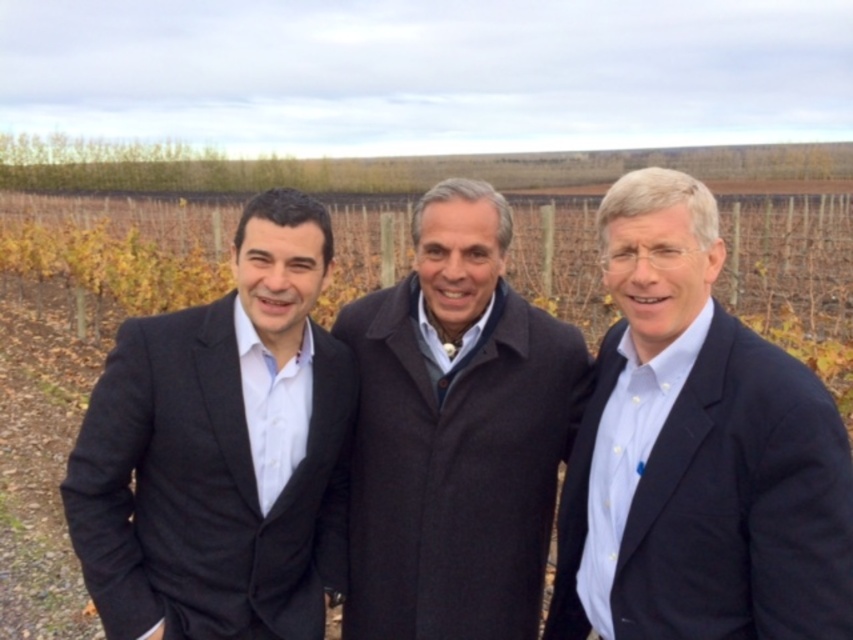
Question: Which is nearer to the matte black suit at left?

Choices:
 (A) dark brown wool coat at center
 (B) light blue shirt at center

Answer: (A)

Question: Is light blue shirt at center above dark brown wool coat at center?

Choices:
 (A) yes
 (B) no

Answer: (B)

Question: From the image, what is the correct spatial relationship of matte black suit at left in relation to dark brown wool coat at center?

Choices:
 (A) above
 (B) below

Answer: (B)

Question: Considering the relative positions of matte black suit at left and dark brown wool coat at center in the image provided, where is matte black suit at left located with respect to dark brown wool coat at center?

Choices:
 (A) above
 (B) below

Answer: (B)

Question: Which point appears closest to the camera in this image?

Choices:
 (A) (x=621, y=304)
 (B) (x=535, y=600)

Answer: (A)

Question: Which point is farther from the camera taking this photo?

Choices:
 (A) (177, 476)
 (B) (680, 576)
 (C) (463, 492)

Answer: (C)